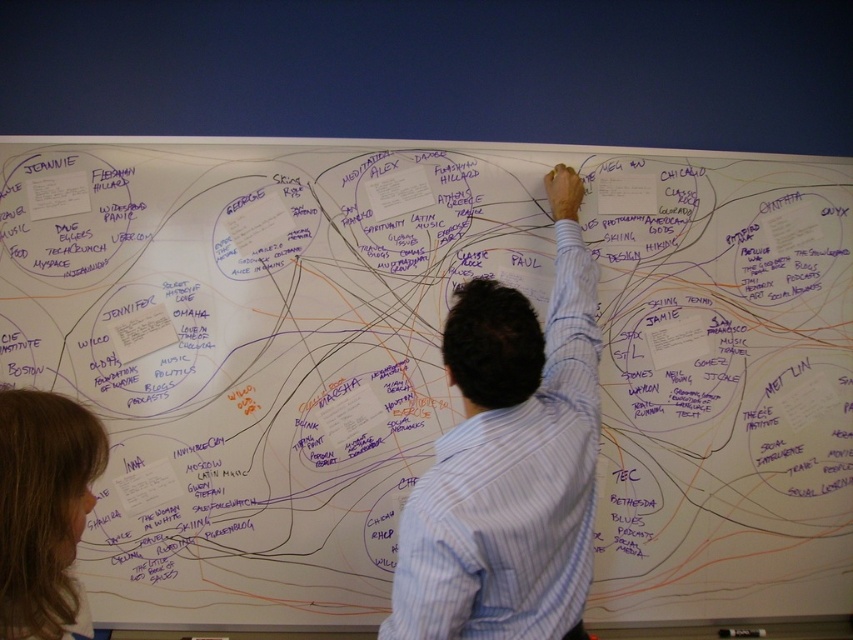
Does white striped shirt at center lie behind brown hair at lower left?

Yes, white striped shirt at center is behind brown hair at lower left.

Is white striped shirt at center wider than brown hair at lower left?

Yes.

You are a GUI agent. You are given a task and a screenshot of the screen. Output one action in this format:
    pyautogui.click(x=<x>, y=<y>)
    Task: Click on the white striped shirt at center
    This screenshot has width=853, height=640.
    Given the screenshot: What is the action you would take?
    pyautogui.click(x=509, y=461)

Locate an element on the screen. This screenshot has width=853, height=640. white striped shirt at center is located at coordinates (509, 461).